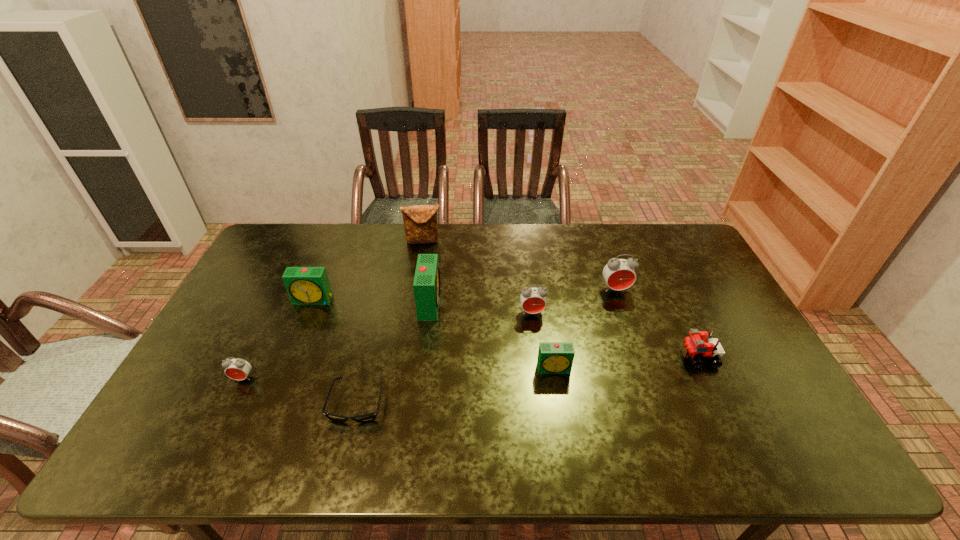
This screenshot has width=960, height=540. In order to click on Lego in this screenshot , I will do `click(693, 347)`.

Where is `the leftmost alarm clock`? This screenshot has width=960, height=540. the leftmost alarm clock is located at coordinates (238, 369).

The image size is (960, 540). Find the location of `the leftmost red alarm clock`. the leftmost red alarm clock is located at coordinates pyautogui.click(x=238, y=369).

The image size is (960, 540). I want to click on the nearest green alarm clock, so click(x=553, y=357).

The image size is (960, 540). What are the coordinates of `the smallest green alarm clock` in the screenshot? It's located at (553, 357).

Find the location of a particular element. the shortest object is located at coordinates (368, 417).

You are a GUI agent. You are given a task and a screenshot of the screen. Output one action in this format:
    pyautogui.click(x=<x>, y=<y>)
    Task: Click on the free space located on the open side of the clutch bag
    
    Given the screenshot: What is the action you would take?
    pyautogui.click(x=419, y=272)

Where is `vacant space positioned on the face of the second object from right to left`? The width and height of the screenshot is (960, 540). vacant space positioned on the face of the second object from right to left is located at coordinates (624, 314).

At what (x,y) coordinates should I click in order to perform the action: click on free space located 0.100m on the front-facing side of the biggest green alarm clock. Please return your answer as a coordinate pair (x, y). This screenshot has height=540, width=960. Looking at the image, I should click on (472, 303).

Where is `vacant region located on the face of the second nearest red alarm clock`? vacant region located on the face of the second nearest red alarm clock is located at coordinates (539, 363).